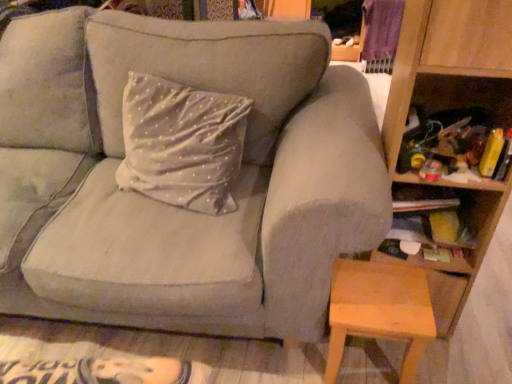
Question: Should I look upward or downward to see suede gray couch at center?

Choices:
 (A) up
 (B) down

Answer: (A)

Question: Is wooden stool at lower right not close to suede gray couch at center?

Choices:
 (A) no
 (B) yes

Answer: (A)

Question: Is wooden stool at lower right at the right side of suede gray couch at center?

Choices:
 (A) yes
 (B) no

Answer: (A)

Question: Does wooden stool at lower right have a smaller size compared to suede gray couch at center?

Choices:
 (A) yes
 (B) no

Answer: (A)

Question: Is wooden stool at lower right looking in the opposite direction of suede gray couch at center?

Choices:
 (A) yes
 (B) no

Answer: (A)

Question: From a real-world perspective, is wooden stool at lower right on suede gray couch at center?

Choices:
 (A) no
 (B) yes

Answer: (A)

Question: Can you confirm if wooden stool at lower right is taller than suede gray couch at center?

Choices:
 (A) no
 (B) yes

Answer: (A)

Question: Could you tell me if wooden bookshelf at right is turned towards wooden stool at lower right?

Choices:
 (A) no
 (B) yes

Answer: (B)

Question: From a real-world perspective, does wooden bookshelf at right sit lower than wooden stool at lower right?

Choices:
 (A) no
 (B) yes

Answer: (A)

Question: Can you confirm if wooden bookshelf at right is smaller than wooden stool at lower right?

Choices:
 (A) yes
 (B) no

Answer: (B)

Question: Is wooden bookshelf at right closer to camera compared to wooden stool at lower right?

Choices:
 (A) yes
 (B) no

Answer: (A)

Question: Is wooden bookshelf at right at the right side of wooden stool at lower right?

Choices:
 (A) no
 (B) yes

Answer: (B)

Question: From a real-world perspective, is wooden bookshelf at right over wooden stool at lower right?

Choices:
 (A) yes
 (B) no

Answer: (A)

Question: Considering the relative positions of wooden stool at lower right and wooden bookshelf at right in the image provided, is wooden stool at lower right behind wooden bookshelf at right?

Choices:
 (A) yes
 (B) no

Answer: (A)